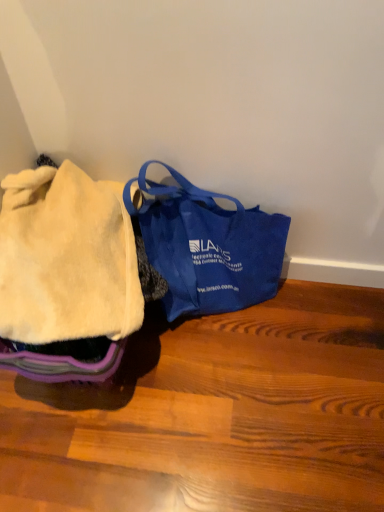
Question: Is there a large distance between blue canvas bag at center and fuzzy cream blanket at left?

Choices:
 (A) no
 (B) yes

Answer: (A)

Question: From the image's perspective, does blue canvas bag at center appear higher than fuzzy cream blanket at left?

Choices:
 (A) yes
 (B) no

Answer: (B)

Question: Is blue canvas bag at center taller than fuzzy cream blanket at left?

Choices:
 (A) no
 (B) yes

Answer: (B)

Question: Is blue canvas bag at center positioned with its back to fuzzy cream blanket at left?

Choices:
 (A) no
 (B) yes

Answer: (A)

Question: From a real-world perspective, is blue canvas bag at center physically above fuzzy cream blanket at left?

Choices:
 (A) no
 (B) yes

Answer: (A)

Question: Does blue canvas bag at center have a larger size compared to fuzzy cream blanket at left?

Choices:
 (A) yes
 (B) no

Answer: (A)

Question: Considering the relative sizes of fuzzy cream blanket at left and blue canvas bag at center in the image provided, is fuzzy cream blanket at left bigger than blue canvas bag at center?

Choices:
 (A) yes
 (B) no

Answer: (B)

Question: From the image's perspective, is fuzzy cream blanket at left on blue canvas bag at center?

Choices:
 (A) no
 (B) yes

Answer: (B)

Question: From a real-world perspective, is fuzzy cream blanket at left on blue canvas bag at center?

Choices:
 (A) yes
 (B) no

Answer: (A)

Question: Is fuzzy cream blanket at left positioned with its back to blue canvas bag at center?

Choices:
 (A) yes
 (B) no

Answer: (B)

Question: Is the position of fuzzy cream blanket at left less distant than that of blue canvas bag at center?

Choices:
 (A) no
 (B) yes

Answer: (B)

Question: Can you confirm if fuzzy cream blanket at left is positioned to the left of blue canvas bag at center?

Choices:
 (A) no
 (B) yes

Answer: (B)

Question: Looking at their shapes, would you say fuzzy cream blanket at left is wider or thinner than blue canvas bag at center?

Choices:
 (A) wide
 (B) thin

Answer: (A)